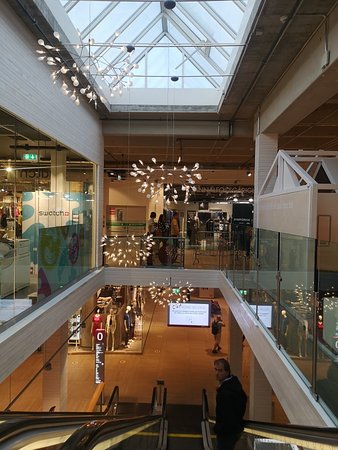
The image size is (338, 450). I want to click on chandelier, so click(169, 280).